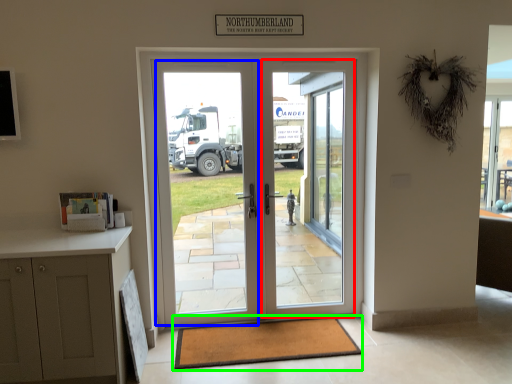
Question: Based on their relative distances, which object is farther from screen door (highlighted by a red box)? Choose from screen door (highlighted by a blue box) and mat (highlighted by a green box).

Choices:
 (A) screen door
 (B) mat

Answer: (B)